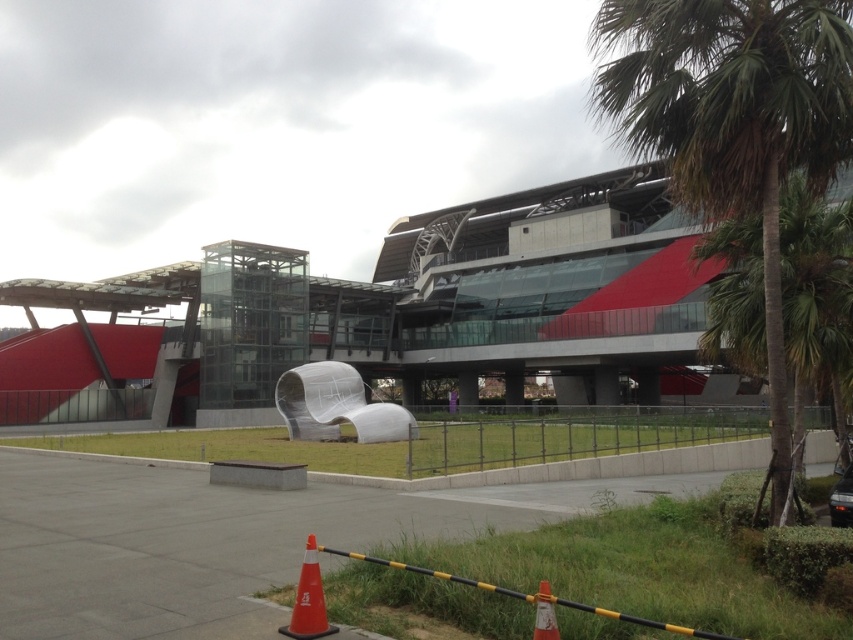
Who is higher up, orange matte cone at lower center or orange matte traffic cone at lower center?

Positioned higher is orange matte traffic cone at lower center.

Is orange matte cone at lower center positioned before orange matte traffic cone at lower center?

No, orange matte cone at lower center is behind orange matte traffic cone at lower center.

Is point (311, 554) positioned in front of point (543, 584)?

No, (311, 554) is behind (543, 584).

Identify the location of orange matte cone at lower center. (308, 600).

Which is in front, point (828, 177) or point (299, 616)?

Point (299, 616) is in front.

Is point (776, 406) positioned in front of point (305, 612)?

No.

Measure the distance between green leafy palm tree at right and camera.

green leafy palm tree at right is 6.61 meters from camera.

Locate an element on the screen. The image size is (853, 640). green leafy palm tree at right is located at coordinates (733, 122).

Can you confirm if green leafy palm tree at right is positioned above orange matte traffic cone at lower center?

Yes, green leafy palm tree at right is above orange matte traffic cone at lower center.

Between green leafy palm tree at right and orange matte traffic cone at lower center, which one appears on the left side from the viewer's perspective?

From the viewer's perspective, orange matte traffic cone at lower center appears more on the left side.

Which is behind, point (717, 97) or point (546, 632)?

Positioned behind is point (717, 97).

The height and width of the screenshot is (640, 853). Find the location of `green leafy palm tree at right`. green leafy palm tree at right is located at coordinates [x=733, y=122].